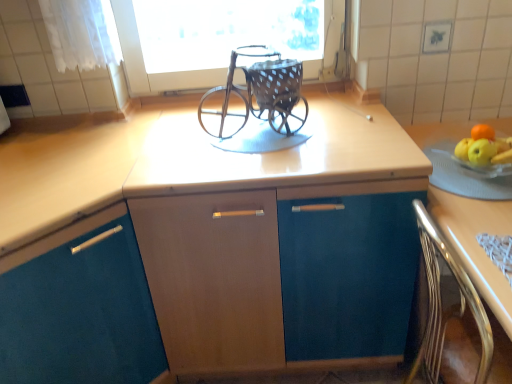
Question: Is matte wood cabinet at center, the second cabinetry viewed from the left, positioned in front of light brown wood at right?

Choices:
 (A) no
 (B) yes

Answer: (A)

Question: Is matte wood cabinet at center, the second cabinetry viewed from the left, to the left of light brown wood at right from the viewer's perspective?

Choices:
 (A) yes
 (B) no

Answer: (A)

Question: Is light brown wood at right inside matte wood cabinet at center, the second cabinetry viewed from the left?

Choices:
 (A) yes
 (B) no

Answer: (B)

Question: Is matte wood cabinet at center, acting as the first cabinetry starting from the right, not inside light brown wood at right?

Choices:
 (A) yes
 (B) no

Answer: (A)

Question: Is matte wood cabinet at center, acting as the first cabinetry starting from the right, smaller than light brown wood at right?

Choices:
 (A) yes
 (B) no

Answer: (A)

Question: From a real-world perspective, relative to matte wood cabinet at center, the second cabinetry viewed from the left, is teal matte cabinet at center, the second cabinetry when ordered from right to left, vertically above or below?

Choices:
 (A) below
 (B) above

Answer: (B)

Question: Is teal matte cabinet at center, the second cabinetry when ordered from right to left, inside or outside of matte wood cabinet at center, acting as the first cabinetry starting from the right?

Choices:
 (A) outside
 (B) inside

Answer: (A)

Question: Is point (50, 334) positioned closer to the camera than point (407, 324)?

Choices:
 (A) farther
 (B) closer

Answer: (B)

Question: In terms of size, does teal matte cabinet at center, the second cabinetry when ordered from right to left, appear bigger or smaller than matte wood cabinet at center, acting as the first cabinetry starting from the right?

Choices:
 (A) big
 (B) small

Answer: (A)

Question: Does point (408, 314) appear closer or farther from the camera than point (458, 203)?

Choices:
 (A) closer
 (B) farther

Answer: (B)

Question: From the image's perspective, is matte wood cabinet at center, acting as the first cabinetry starting from the right, positioned above or below light brown wood at right?

Choices:
 (A) below
 (B) above

Answer: (B)

Question: Is matte wood cabinet at center, acting as the first cabinetry starting from the right, wider or thinner than light brown wood at right?

Choices:
 (A) thin
 (B) wide

Answer: (B)

Question: From their relative heights in the image, would you say matte wood cabinet at center, acting as the first cabinetry starting from the right, is taller or shorter than light brown wood at right?

Choices:
 (A) short
 (B) tall

Answer: (B)

Question: Looking at their shapes, would you say metallic polished chair at lower right is wider or thinner than rustic metal baby carriage at center?

Choices:
 (A) thin
 (B) wide

Answer: (B)

Question: Considering their positions, is metallic polished chair at lower right located in front of or behind rustic metal baby carriage at center?

Choices:
 (A) front
 (B) behind

Answer: (A)